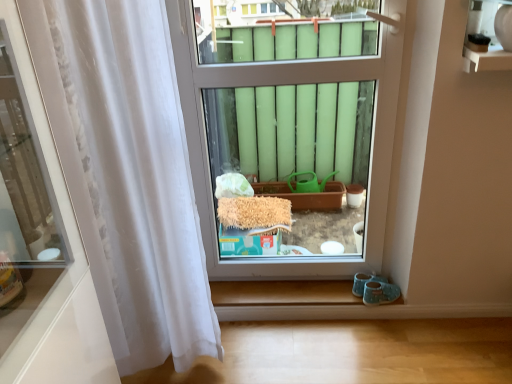
Question: From the image's perspective, does transparent glass window at center appear higher than white sheer curtain at left?

Choices:
 (A) yes
 (B) no

Answer: (A)

Question: Does transparent glass window at center appear on the right side of white sheer curtain at left?

Choices:
 (A) no
 (B) yes

Answer: (B)

Question: Does transparent glass window at center have a greater width compared to white sheer curtain at left?

Choices:
 (A) no
 (B) yes

Answer: (A)

Question: Could white sheer curtain at left be considered to be inside transparent glass window at center?

Choices:
 (A) yes
 (B) no

Answer: (B)

Question: From the image's perspective, is transparent glass window at center below white sheer curtain at left?

Choices:
 (A) yes
 (B) no

Answer: (B)

Question: Is transparent glass window at center facing towards white sheer curtain at left?

Choices:
 (A) no
 (B) yes

Answer: (A)

Question: Does white sheer curtain at left lie in front of transparent glass window at center?

Choices:
 (A) no
 (B) yes

Answer: (B)

Question: Can you confirm if white sheer curtain at left is thinner than transparent glass window at center?

Choices:
 (A) yes
 (B) no

Answer: (B)

Question: Can you confirm if white sheer curtain at left is positioned to the left of transparent glass window at center?

Choices:
 (A) no
 (B) yes

Answer: (B)

Question: Can you confirm if white sheer curtain at left is wider than transparent glass window at center?

Choices:
 (A) yes
 (B) no

Answer: (A)

Question: Is white sheer curtain at left shorter than transparent glass window at center?

Choices:
 (A) no
 (B) yes

Answer: (A)

Question: Is white sheer curtain at left oriented away from transparent glass window at center?

Choices:
 (A) no
 (B) yes

Answer: (A)

Question: Is transparent glass window at center wider or thinner than white sheer curtain at left?

Choices:
 (A) wide
 (B) thin

Answer: (B)